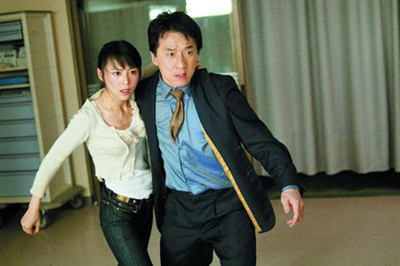
Image resolution: width=400 pixels, height=266 pixels. I want to click on drawers, so click(12, 111), click(15, 131), click(16, 146), click(18, 161), click(18, 186).